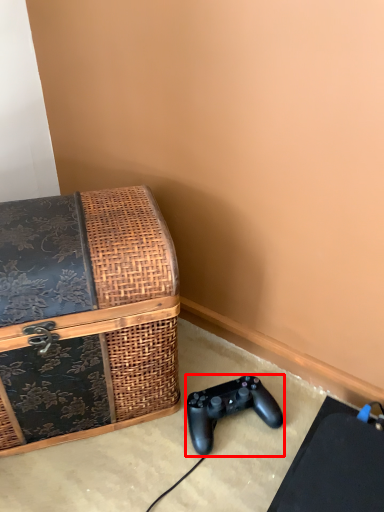
Question: From the image's perspective, considering the relative positions of game controller (annotated by the red box) and box in the image provided, where is game controller (annotated by the red box) located with respect to the staircase?

Choices:
 (A) below
 (B) above

Answer: (A)